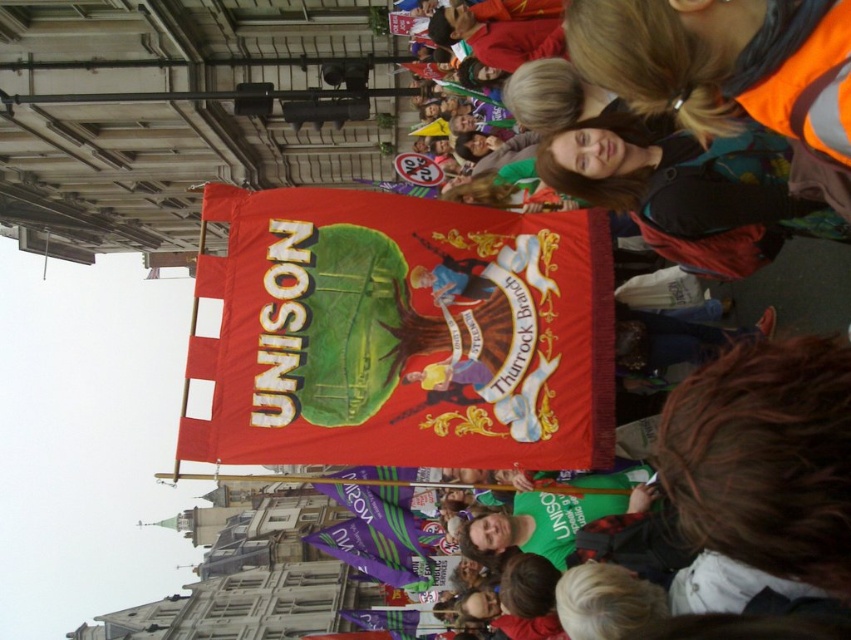
Question: Considering the real-world distances, which object is closest to the purple fabric flag at lower center?

Choices:
 (A) red fabric banner at center
 (B) purple fabric banner at center

Answer: (B)

Question: Which point is closer to the camera?

Choices:
 (A) (357, 518)
 (B) (373, 234)
 (C) (412, 632)

Answer: (B)

Question: Is red fabric banner at center smaller than purple fabric banner at center?

Choices:
 (A) yes
 (B) no

Answer: (A)

Question: Does purple fabric flag at lower center have a larger size compared to purple fabric banner at center?

Choices:
 (A) yes
 (B) no

Answer: (A)

Question: Does purple fabric flag at lower center appear on the right side of purple fabric banner at center?

Choices:
 (A) yes
 (B) no

Answer: (B)

Question: Which object is closer to the camera taking this photo?

Choices:
 (A) red fabric banner at center
 (B) purple fabric banner at center
 (C) purple fabric flag at lower center

Answer: (A)